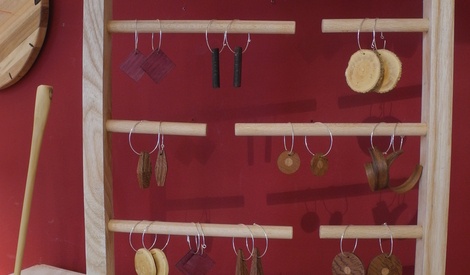
This screenshot has width=470, height=275. In order to click on left post of stand holding medals in this screenshot , I will do (92, 187).